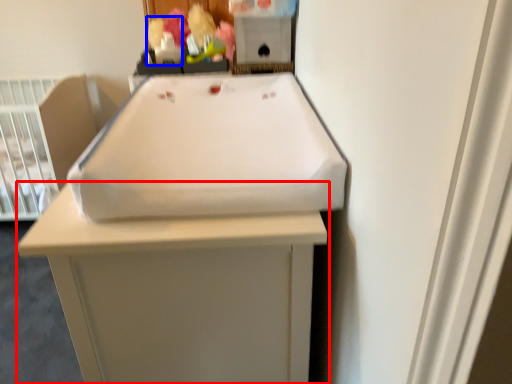
Question: Among these objects, which one is nearest to the camera, furniture (highlighted by a red box) or toy (highlighted by a blue box)?

Choices:
 (A) furniture
 (B) toy

Answer: (A)